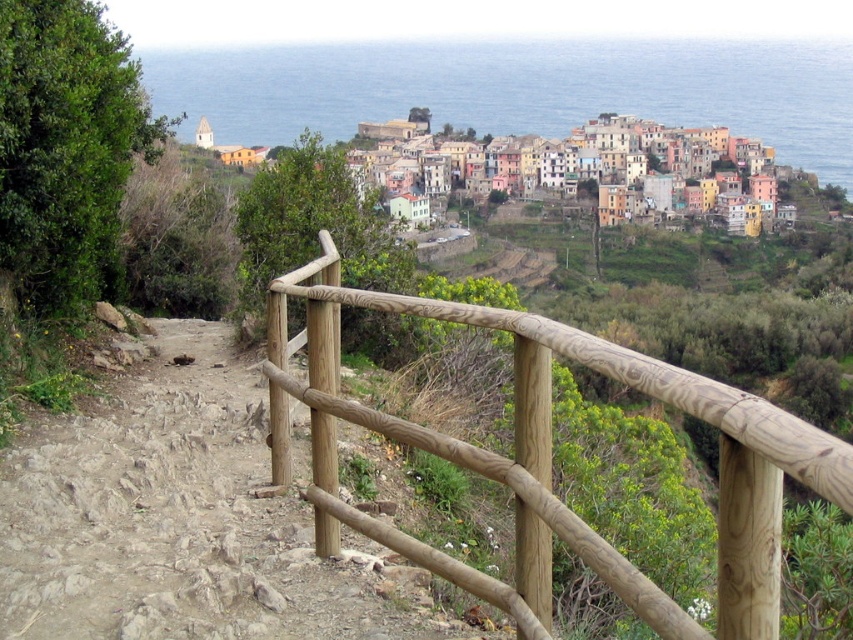
Can you confirm if natural wood railing at center is taller than pastel painted houses at center?

No, natural wood railing at center is not taller than pastel painted houses at center.

What are the coordinates of `natural wood railing at center` in the screenshot? It's located at (550, 456).

Who is more forward, (303, 332) or (512, 170)?

Point (303, 332) is in front.

I want to click on natural wood railing at center, so click(550, 456).

Does brown dirt trail at lower left have a smaller size compared to natural wood railing at center?

Yes.

Where is `brown dirt trail at lower left`? The height and width of the screenshot is (640, 853). brown dirt trail at lower left is located at coordinates (183, 524).

Which is behind, point (215, 477) or point (512, 144)?

The point (512, 144) is behind.

What do you see at coordinates (183, 524) in the screenshot?
I see `brown dirt trail at lower left` at bounding box center [183, 524].

You are a GUI agent. You are given a task and a screenshot of the screen. Output one action in this format:
    pyautogui.click(x=<x>, y=<y>)
    Task: Click on the brown dirt trail at lower left
    The image size is (853, 640).
    Given the screenshot: What is the action you would take?
    pyautogui.click(x=183, y=524)